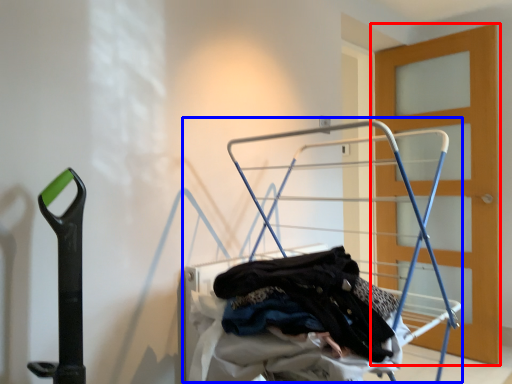
Question: Which object is closer to the camera taking this photo, door (highlighted by a red box) or baby carriage (highlighted by a blue box)?

Choices:
 (A) door
 (B) baby carriage

Answer: (B)